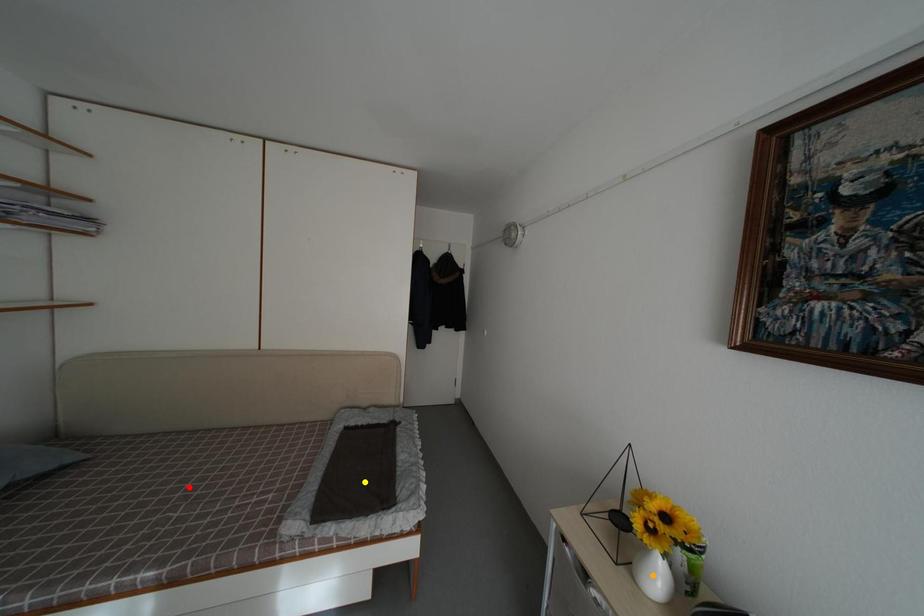
Order these from nearest to farthest:
red point, yellow point, orange point

orange point → red point → yellow point